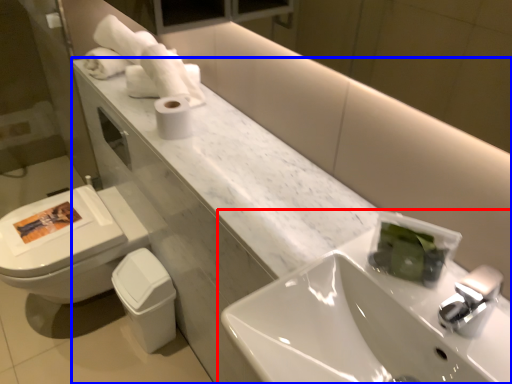
Question: Which point is closer to the camera, sink (highlighted by a red box) or counter (highlighted by a blue box)?

Choices:
 (A) sink
 (B) counter

Answer: (A)